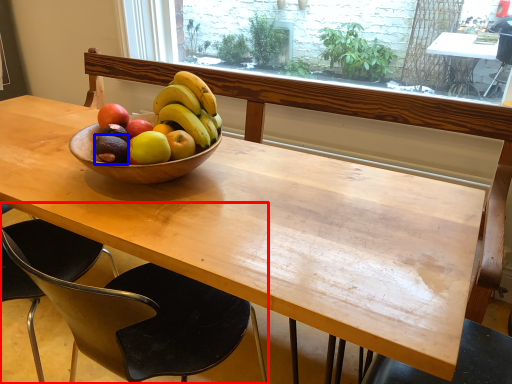
Question: Which point is closer to the camera, chair (highlighted by a red box) or avocado (highlighted by a blue box)?

Choices:
 (A) chair
 (B) avocado

Answer: (A)